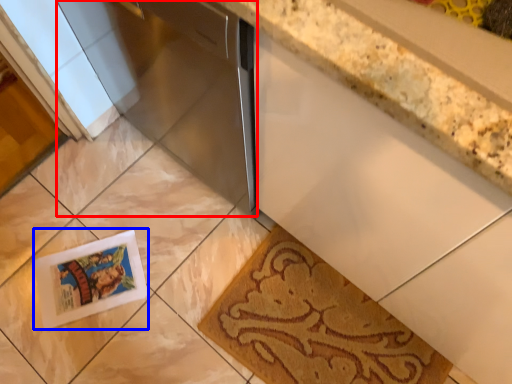
Question: Which of the following is the closest to the observer, appliance (highlighted by a red box) or postcard (highlighted by a blue box)?

Choices:
 (A) appliance
 (B) postcard

Answer: (A)